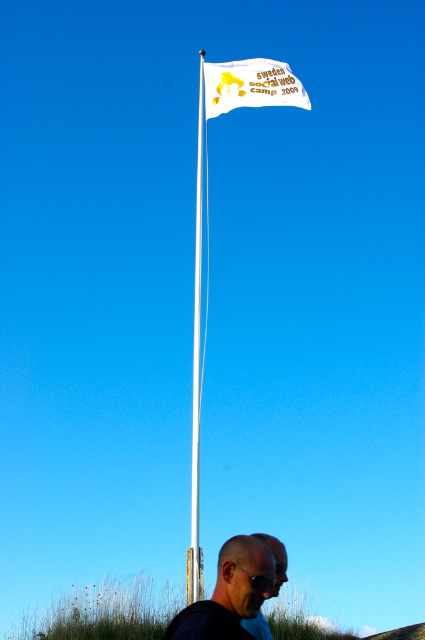
Who is more forward, (280,612) or (234,80)?

Point (234,80) is more forward.

Does green grass at lower center have a greater width compared to white fabric flag at upper center?

Incorrect, green grass at lower center's width does not surpass white fabric flag at upper center's.

This screenshot has height=640, width=425. What are the coordinates of `green grass at lower center` in the screenshot? It's located at (104, 611).

Find the location of a particular element. Image resolution: width=425 pixels, height=640 pixels. green grass at lower center is located at coordinates (104, 611).

Between white fabric flag at upper center and white plastic flag pole at upper center, which one has less height?

Standing shorter between the two is white fabric flag at upper center.

Is white fabric flag at upper center shorter than white plastic flag pole at upper center?

Correct, white fabric flag at upper center is not as tall as white plastic flag pole at upper center.

Describe the element at coordinates (251, 84) in the screenshot. I see `white fabric flag at upper center` at that location.

What are the coordinates of `white fabric flag at upper center` in the screenshot? It's located at (251, 84).

This screenshot has width=425, height=640. What do you see at coordinates (229, 593) in the screenshot?
I see `dark blue shirt at lower center` at bounding box center [229, 593].

Who is shorter, dark blue shirt at lower center or matte black sunglasses at lower center?

matte black sunglasses at lower center

The image size is (425, 640). In order to click on dark blue shirt at lower center in this screenshot , I will do `click(229, 593)`.